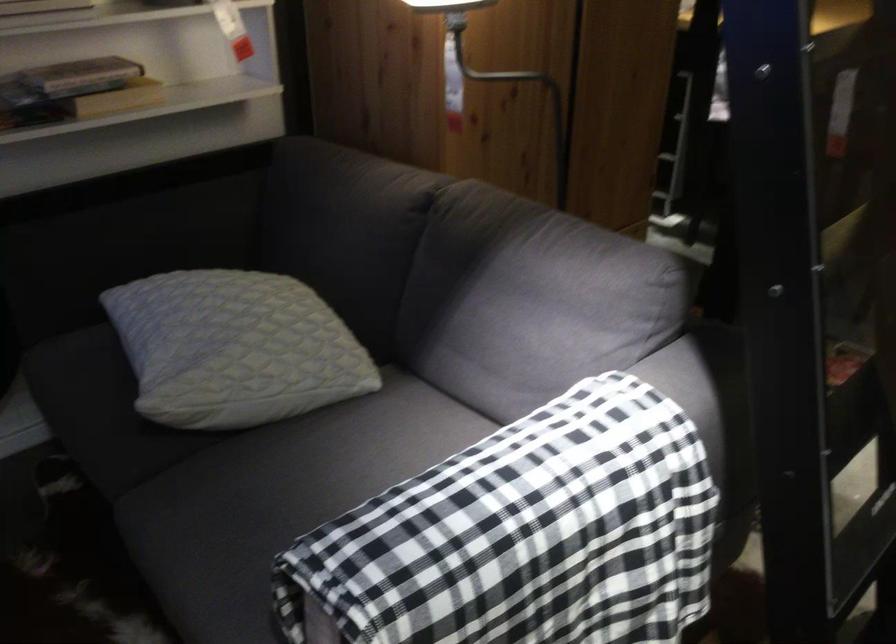
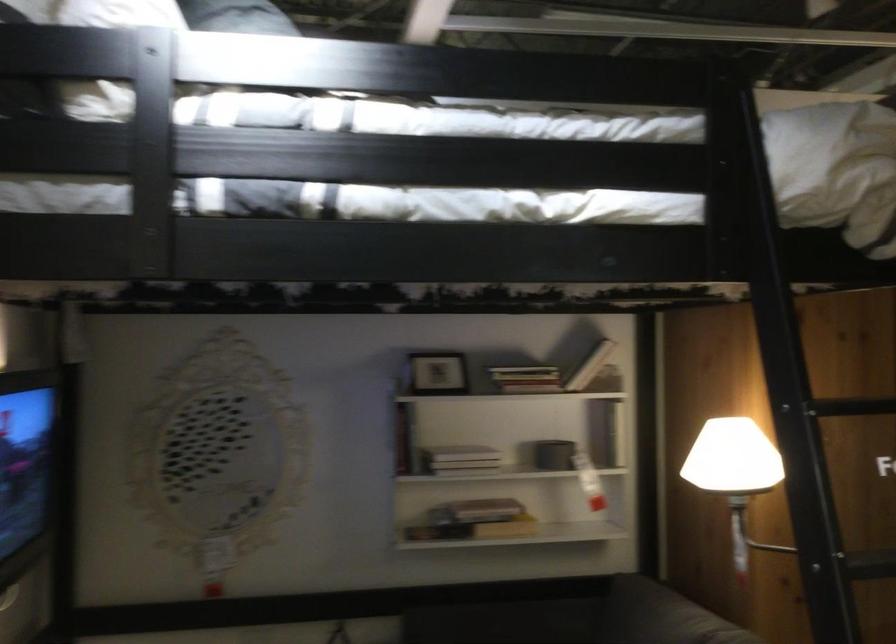
Find the pixel in the second image that matches pixel 74 82 in the first image.

(476, 511)